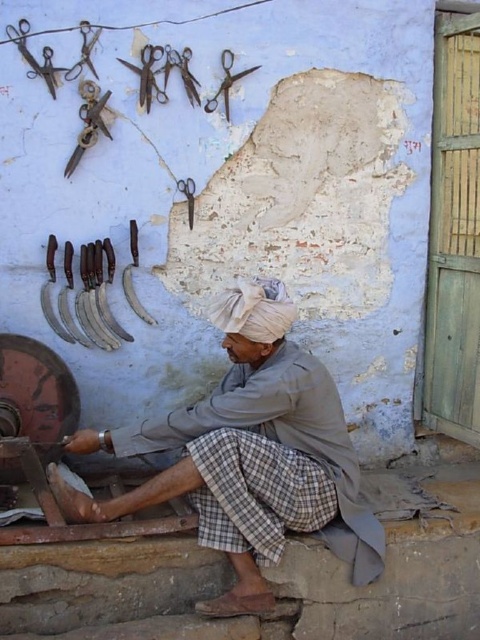
Question: Is antique brass scissors at upper left bigger than metallic sheen scissors at upper center?

Choices:
 (A) yes
 (B) no

Answer: (A)

Question: Considering the real-world distances, which object is farthest from the rusty metal scissors at upper left?

Choices:
 (A) gray fabric turban at center
 (B) rusty metal scissors at upper center
 (C) antique brass scissors at upper left
 (D) metallic shears at upper center

Answer: (A)

Question: Among these objects, which one is nearest to the camera?

Choices:
 (A) metallic shears at upper center
 (B) dark brown leather sickles at center
 (C) silver metallic scissors at upper left

Answer: (C)

Question: Estimate the real-world distances between objects in this image. Which object is farther from the rusty metal scissors at upper center?

Choices:
 (A) gray fabric turban at center
 (B) dark brown leather sickles at center

Answer: (A)

Question: Can you confirm if metallic shears at upper center is positioned above metallic sheen scissors at upper center?

Choices:
 (A) yes
 (B) no

Answer: (A)

Question: Can you confirm if antique brass scissors at upper left is bigger than metallic shears at upper center?

Choices:
 (A) no
 (B) yes

Answer: (A)